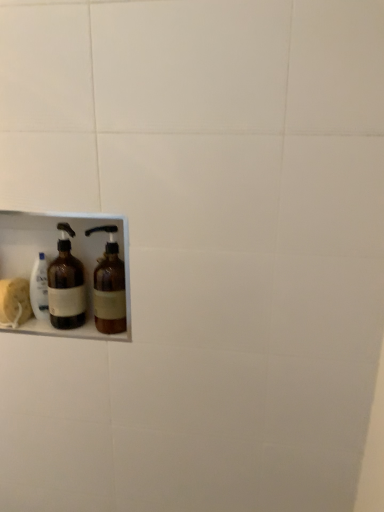
Question: Looking at the image, does brown glass bottle at lower left, which ranks as the first bottle in right-to-left order, seem bigger or smaller compared to brown glass bottle at left, the first bottle from the left?

Choices:
 (A) small
 (B) big

Answer: (B)

Question: From their relative heights in the image, would you say brown glass bottle at lower left, which ranks as the first bottle in right-to-left order, is taller or shorter than brown glass bottle at left, the 2th bottle positioned from the right?

Choices:
 (A) short
 (B) tall

Answer: (A)

Question: Relative to brown glass bottle at left, the 2th bottle positioned from the right, is brown glass bottle at lower left, the 2th bottle positioned from the left, in front or behind?

Choices:
 (A) behind
 (B) front

Answer: (B)

Question: From a real-world perspective, is brown glass bottle at left, the first bottle from the left, physically located above or below brown glass bottle at lower left, the 2th bottle positioned from the left?

Choices:
 (A) below
 (B) above

Answer: (A)

Question: Is point (79, 298) closer or farther from the camera than point (117, 321)?

Choices:
 (A) farther
 (B) closer

Answer: (A)

Question: Considering the positions of brown glass bottle at left, the 2th bottle positioned from the right, and brown glass bottle at lower left, which ranks as the first bottle in right-to-left order, in the image, is brown glass bottle at left, the 2th bottle positioned from the right, taller or shorter than brown glass bottle at lower left, which ranks as the first bottle in right-to-left order,?

Choices:
 (A) short
 (B) tall

Answer: (B)

Question: In terms of size, does brown glass bottle at left, the first bottle from the left, appear bigger or smaller than brown glass bottle at lower left, which ranks as the first bottle in right-to-left order?

Choices:
 (A) small
 (B) big

Answer: (A)